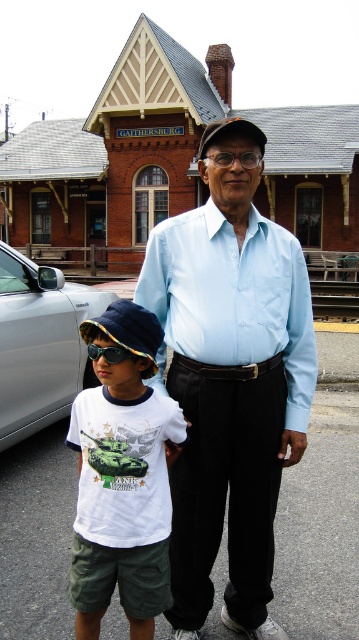
Question: Based on their relative distances, which object is nearer to the silver metallic car at left?

Choices:
 (A) white cotton shirt at center
 (B) blue reflective sunglasses at left
 (C) sunglassestransparent at center

Answer: (A)

Question: Can you confirm if light blue cotton shirt at center is wider than blue reflective sunglasses at left?

Choices:
 (A) yes
 (B) no

Answer: (A)

Question: Is silver metallic car at left positioned before sunglassestransparent at center?

Choices:
 (A) yes
 (B) no

Answer: (B)

Question: Which object is closer to the camera taking this photo?

Choices:
 (A) silver metallic car at left
 (B) blue reflective sunglasses at left

Answer: (B)

Question: Estimate the real-world distances between objects in this image. Which object is closer to the light blue cotton shirt at center?

Choices:
 (A) light blue shirt at center
 (B) silver metallic car at left
 (C) blue reflective sunglasses at left
 (D) sunglassestransparent at center

Answer: (A)

Question: Is light blue shirt at center thinner than white cotton shirt at center?

Choices:
 (A) yes
 (B) no

Answer: (B)